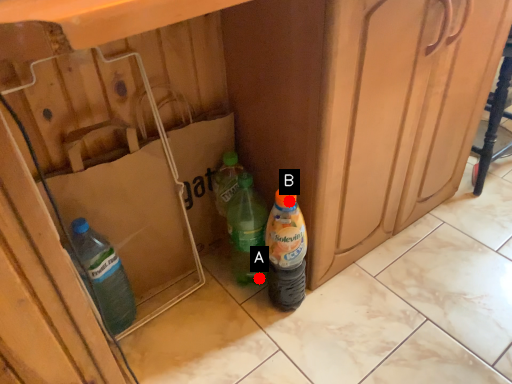
Question: Two points are circled on the image, labeled by A and B beside each circle. Which point appears closest to the camera in this image?

Choices:
 (A) A is closer
 (B) B is closer

Answer: (B)